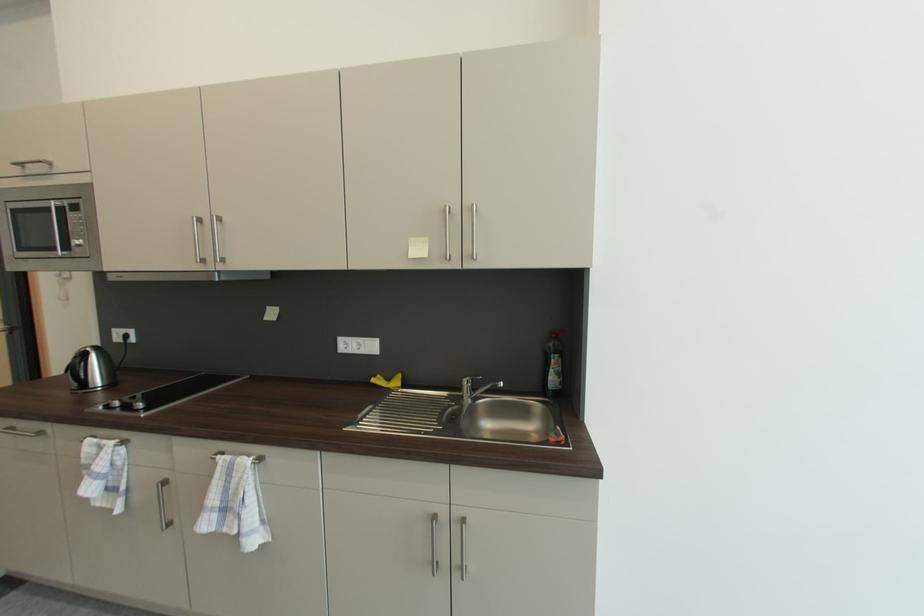
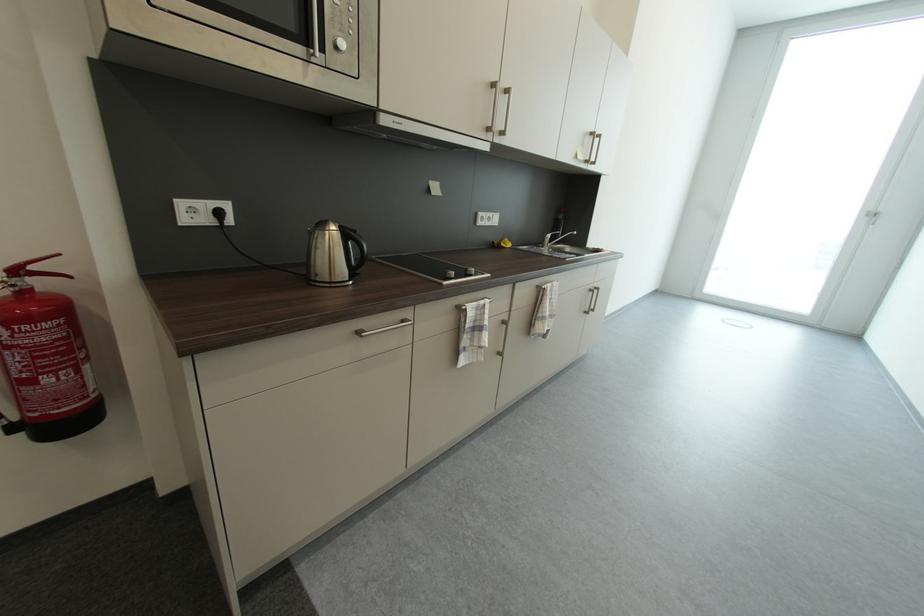
The point at (417, 257) is marked in the first image. Where is the corresponding point in the second image?

(585, 160)